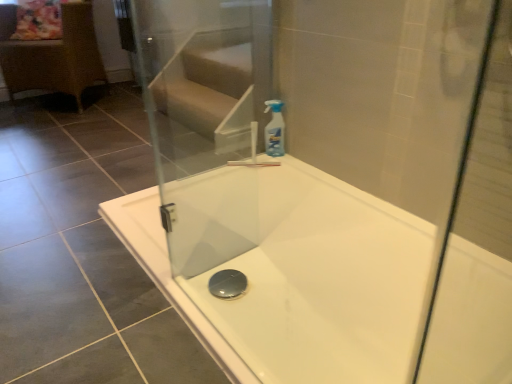
Image resolution: width=512 pixels, height=384 pixels. In order to click on vacant region in front of rattan wicker chair at left in this screenshot , I will do `click(54, 125)`.